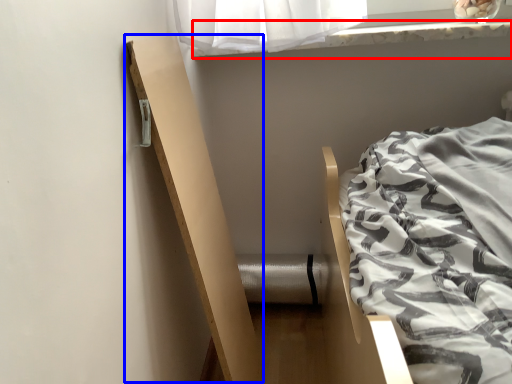
Question: Among these objects, which one is nearest to the camera, window sill (highlighted by a red box) or balustrade (highlighted by a blue box)?

Choices:
 (A) window sill
 (B) balustrade

Answer: (B)